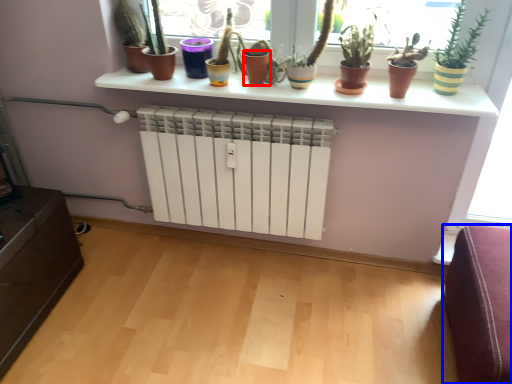
Question: Which of the following is the farthest to the observer, vase (highlighted by a red box) or furniture (highlighted by a blue box)?

Choices:
 (A) vase
 (B) furniture

Answer: (A)